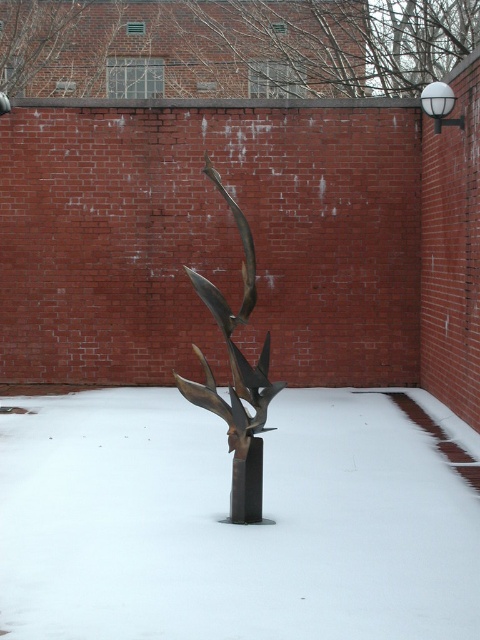
Question: Which point is closer to the camera taking this photo?

Choices:
 (A) (164, 417)
 (B) (252, 429)

Answer: (B)

Question: Which point appears farthest from the camera in this image?

Choices:
 (A) (236, 474)
 (B) (80, 484)
 (C) (240, 417)

Answer: (B)

Question: Among these points, which one is nearest to the camera?

Choices:
 (A) (244, 497)
 (B) (196, 285)

Answer: (B)

Question: Does bronze sculpture at center have a greater width compared to bronze pole at center?

Choices:
 (A) no
 (B) yes

Answer: (B)

Question: Can you confirm if bronze sculpture at center is smaller than bronze pole at center?

Choices:
 (A) no
 (B) yes

Answer: (A)

Question: Is white matte snow at center to the left of bronze sculpture at center from the viewer's perspective?

Choices:
 (A) yes
 (B) no

Answer: (A)